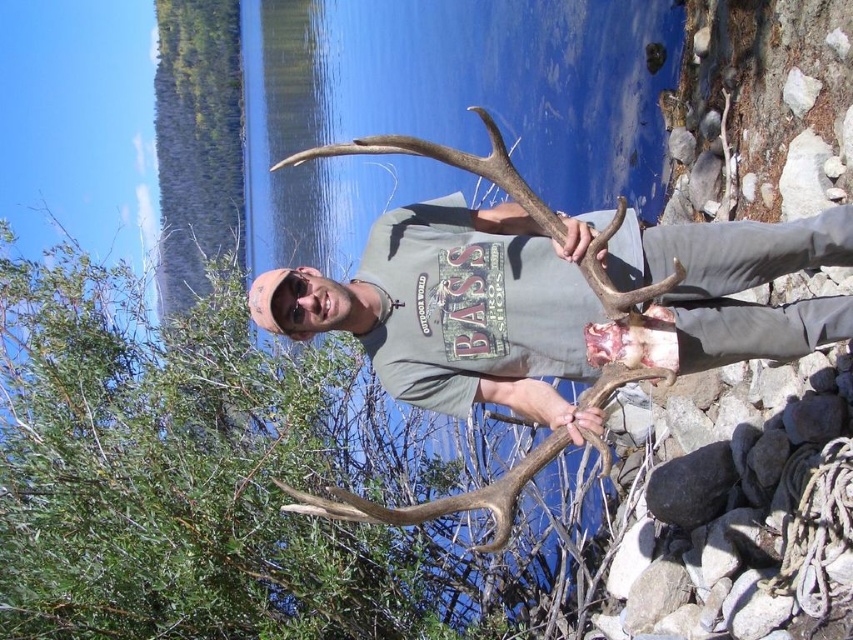
Can you confirm if green leafy bush at center is positioned above gray matte t-shirt at center?

No, green leafy bush at center is not above gray matte t-shirt at center.

Between green leafy bush at center and gray matte t-shirt at center, which one has more height?

Standing taller between the two is green leafy bush at center.

Who is more forward, (59, 269) or (502, 397)?

Point (502, 397) is more forward.

This screenshot has height=640, width=853. Identify the location of green leafy bush at center. (198, 474).